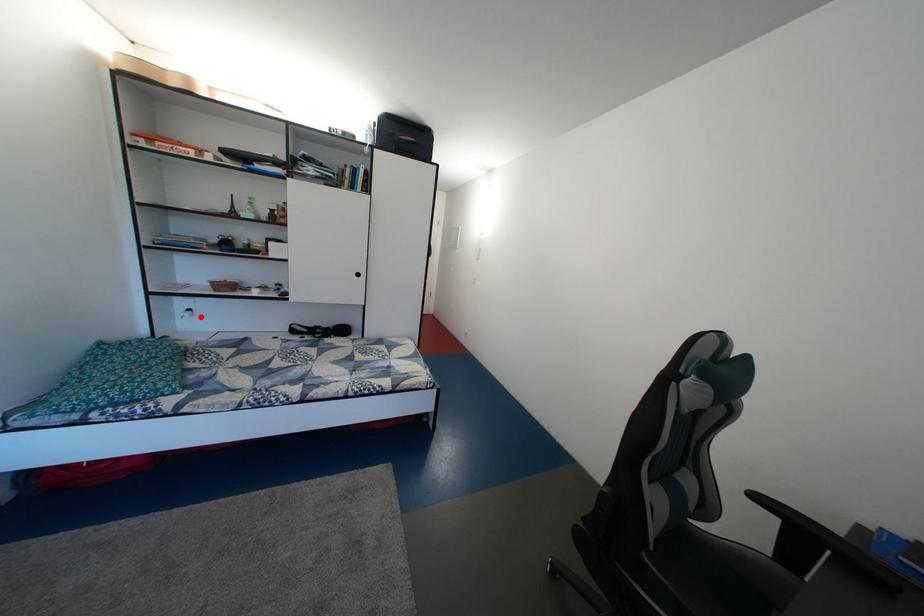
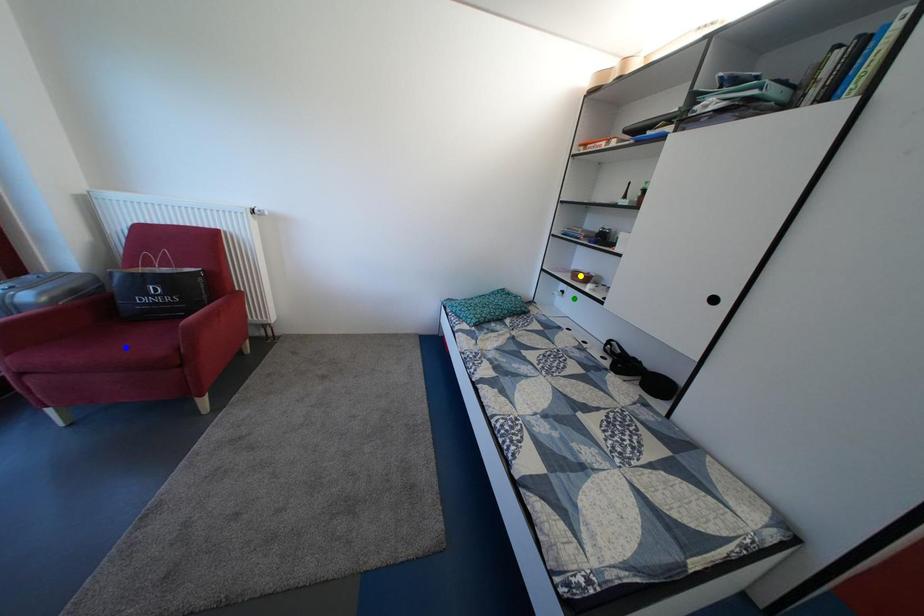
Question: I am providing you with two images of the same scene from different viewpoints. A red point is marked on the first image. You are given multiple points on the second image. Which point in image 2 is actually the same real-world point as the red point in image 1?

Choices:
 (A) green point
 (B) blue point
 (C) yellow point

Answer: (A)